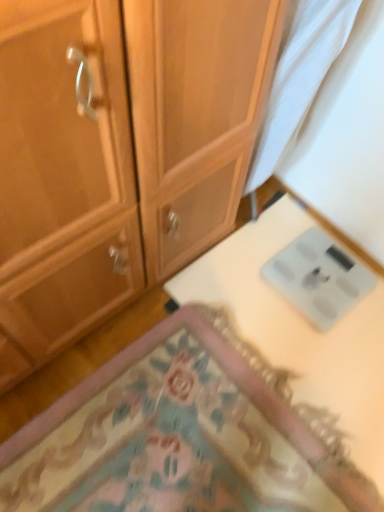
Identify the location of vacant space in front of white sheer curtain at upper right. (259, 262).